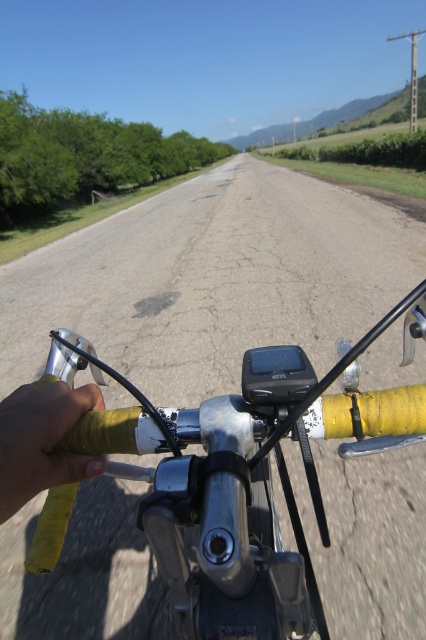
Question: In this image, where is yellow matte handlebar at center located relative to yellow matte handlebar grip at lower left?

Choices:
 (A) above
 (B) below

Answer: (B)

Question: Can you confirm if yellow matte handlebar at center is thinner than yellow matte handlebar grip at lower left?

Choices:
 (A) yes
 (B) no

Answer: (B)

Question: Which point is farther from the camera taking this photo?

Choices:
 (A) (339, 452)
 (B) (71, 468)

Answer: (A)

Question: Does yellow matte handlebar at center appear over yellow matte handlebar grip at lower left?

Choices:
 (A) no
 (B) yes

Answer: (A)

Question: Among these objects, which one is nearest to the camera?

Choices:
 (A) yellow matte handlebar at center
 (B) yellow matte handlebar grip at lower left

Answer: (B)